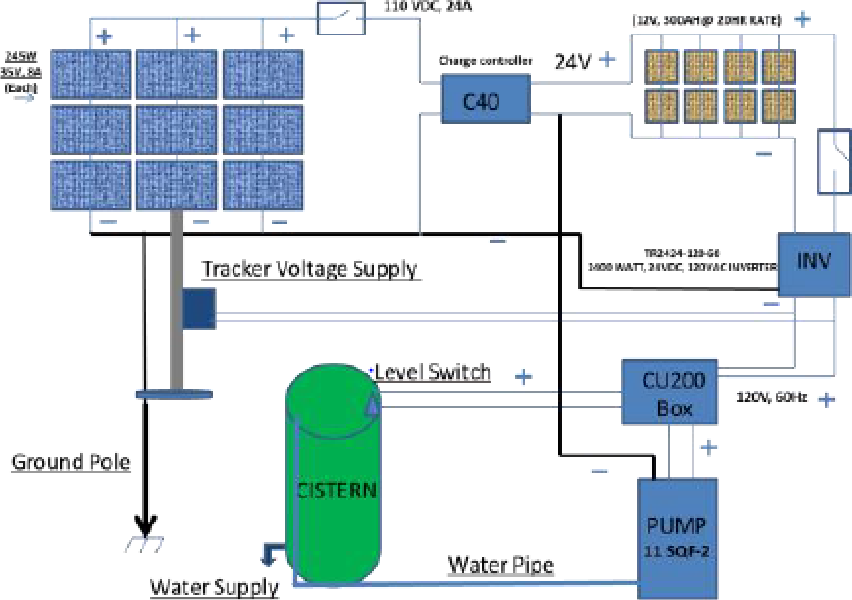
At what (x,y) coordinates should I click in order to perform the action: click on cistern. Please return your answer as a coordinate pair (x, y). The image size is (852, 600). Looking at the image, I should click on (343, 486).